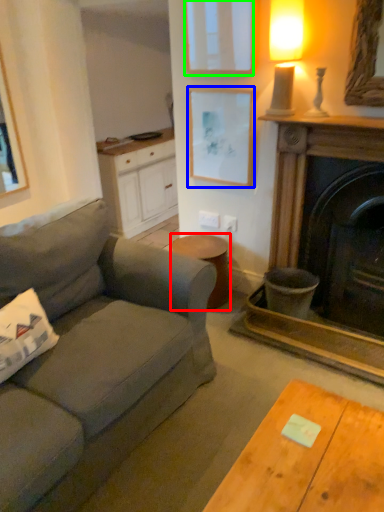
Question: Considering the real-world distances, which object is farthest from stool (highlighted by a red box)? picture frame (highlighted by a blue box) or picture frame (highlighted by a green box)?

Choices:
 (A) picture frame
 (B) picture frame

Answer: (B)